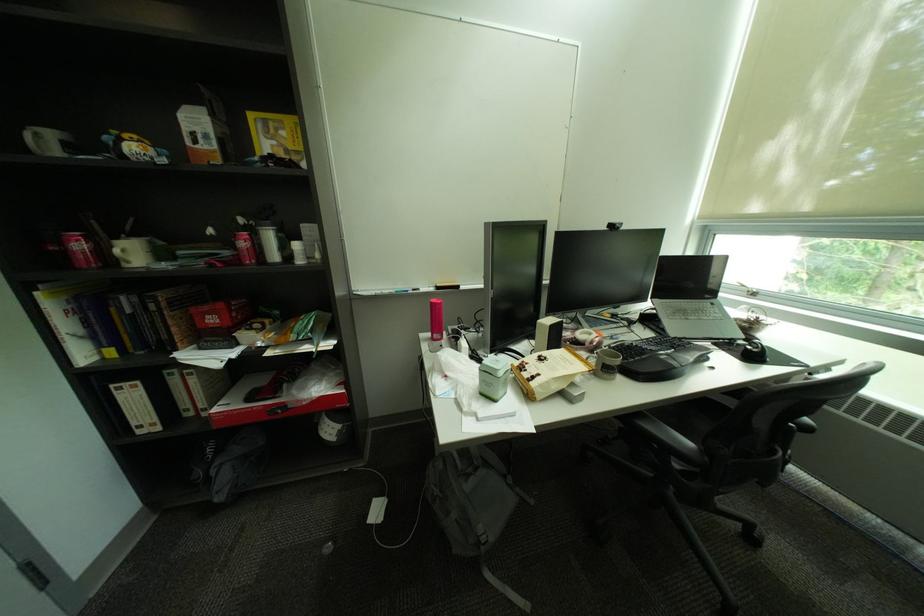
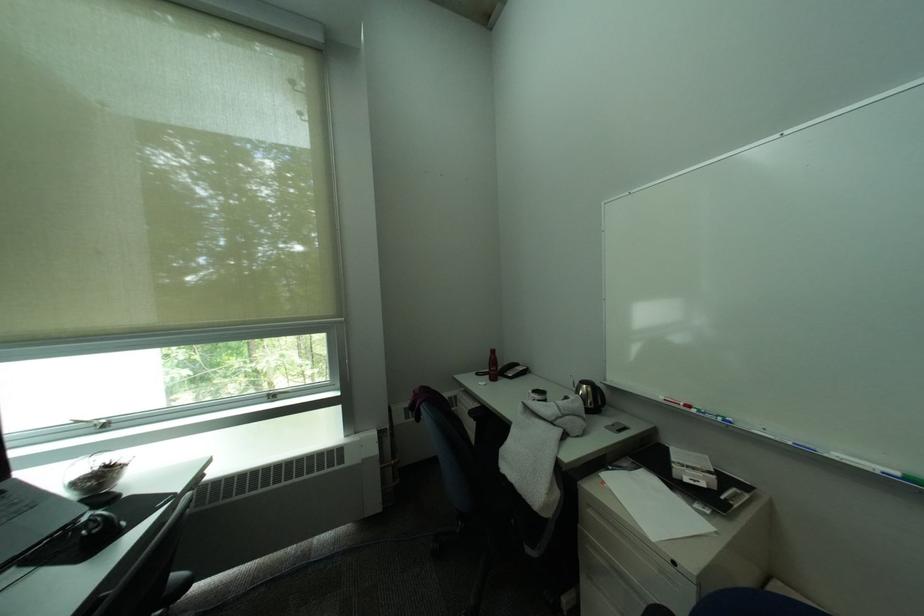
Question: The first image is from the beginning of the video and the second image is from the end. How did the camera likely rotate when shooting the video?

Choices:
 (A) Left
 (B) Right
 (C) Up
 (D) Down

Answer: (B)